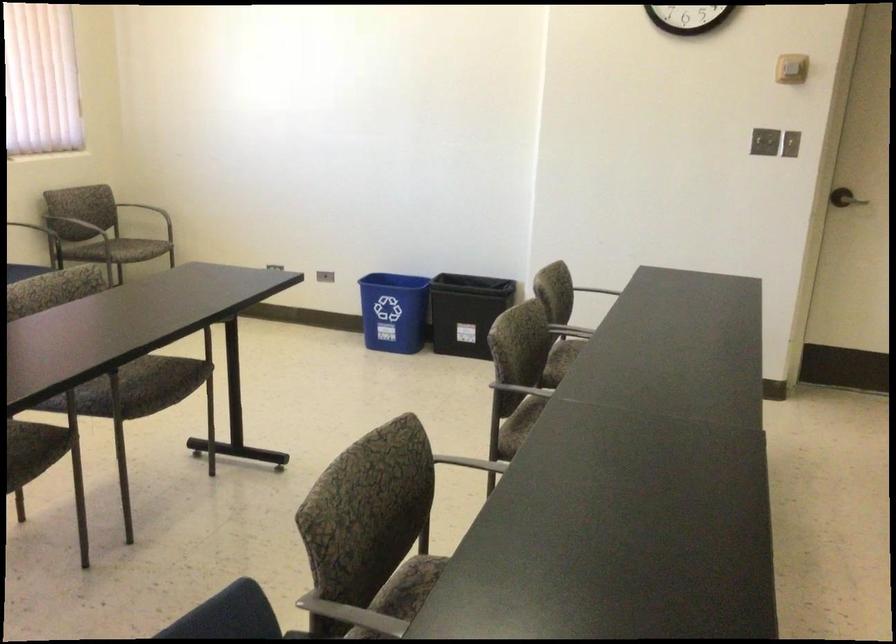
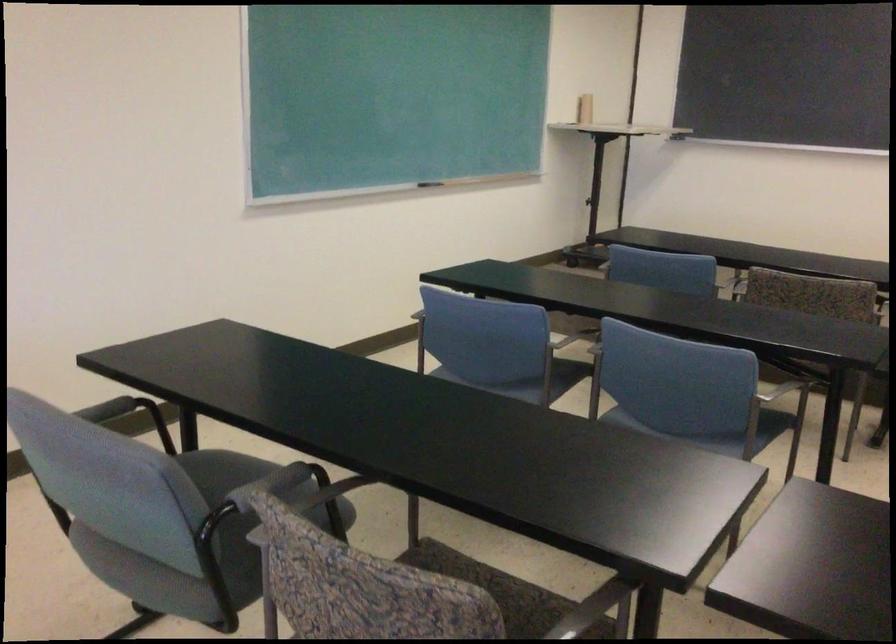
The images are taken continuously from a first-person perspective. In which direction is your viewpoint rotating?

The camera rotated toward right-down.